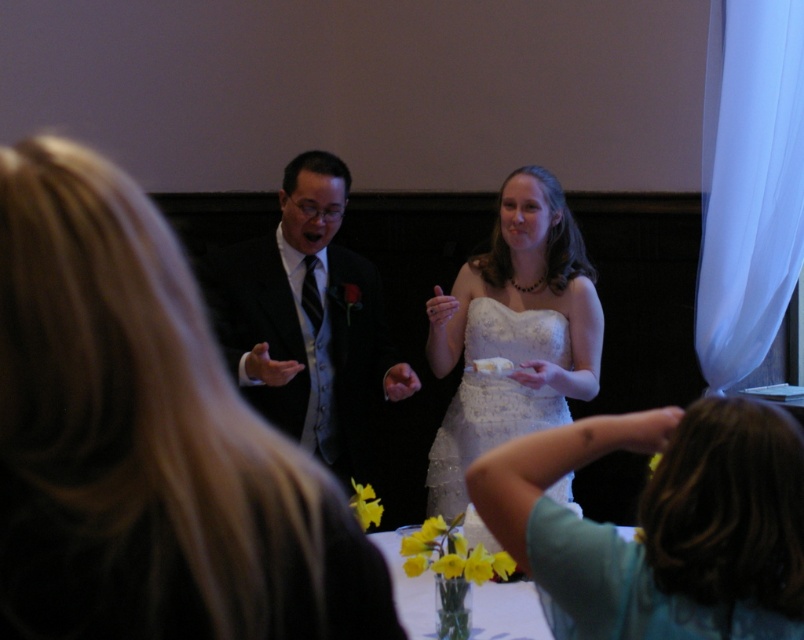
You are a photographer at the wedding reception and want to capture a closeup of the matte white dress at center. Based on its position, which direction should you move to get closer to it?

The matte white dress at center is located at point 0.688 on the x axis and 0.182 on the y axis. To get closer to it, you should move towards the center of the image since it is positioned there.

You are standing at the center of the room and see two points in the image. Which point is closer to you, point (x=167, y=356) or point (x=544, y=534)?

Point (x=167, y=356) is in front of point (x=544, y=534), so it is closer to you.

You are a photographer at the wedding reception. You need to position yourself so that both the black satin suit at center and the white lace dress at center are fully visible in your shot. Given that the camera has a fixed focal length, which subject should you prioritize keeping closer to the camera to ensure both are in frame?

The black satin suit at center might be wider than white lace dress at center, so to ensure both are fully visible, prioritize keeping the black satin suit at center closer to the camera since wider subjects require more space in the frame.